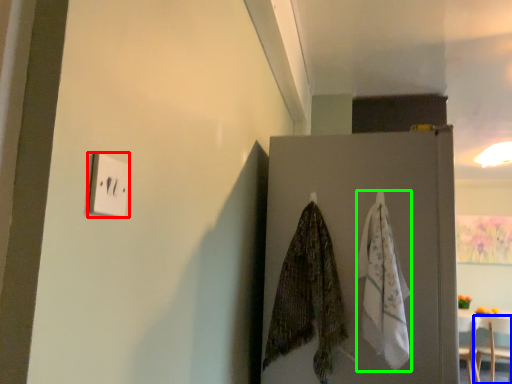
Question: Which object is the farthest from light switch (highlighted by a red box)? Choose among these: furniture (highlighted by a blue box) or blanket (highlighted by a green box).

Choices:
 (A) furniture
 (B) blanket

Answer: (A)